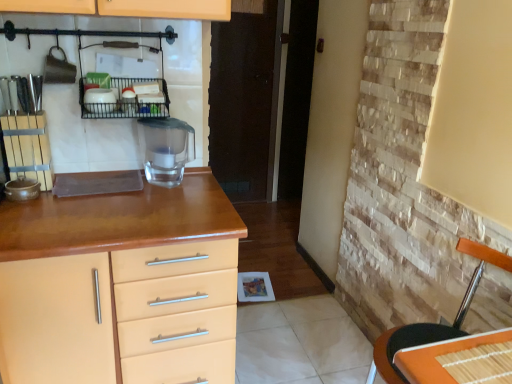
Question: From a real-world perspective, is orange bamboo placemat at lower right above or below orange woven mat at right?

Choices:
 (A) below
 (B) above

Answer: (B)

Question: Is orange bamboo placemat at lower right spatially inside orange woven mat at right, or outside of it?

Choices:
 (A) inside
 (B) outside

Answer: (B)

Question: Which object is the closest to the black wire rack at upper center?

Choices:
 (A) matte wood chest of drawers at left
 (B) orange bamboo placemat at lower right
 (C) transparent glass water filter at center
 (D) orange woven mat at right

Answer: (C)

Question: Which is nearer to the transparent glass water filter at center?

Choices:
 (A) orange bamboo placemat at lower right
 (B) matte wood chest of drawers at left
 (C) black wire rack at upper center
 (D) orange woven mat at right

Answer: (C)